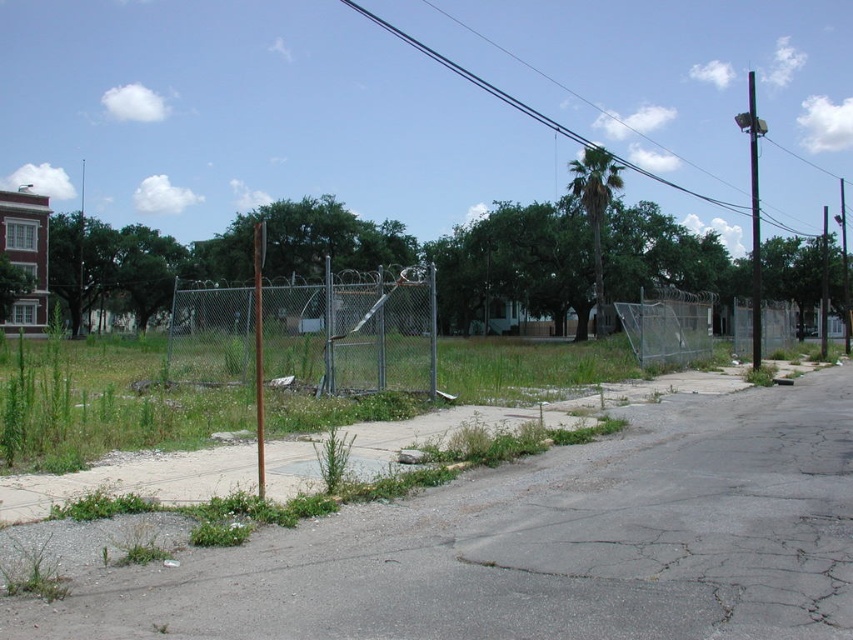
Question: Is green chain-link fence at center further to the viewer compared to green grass at lower left?

Choices:
 (A) yes
 (B) no

Answer: (A)

Question: Where is green grass at lower left located in relation to green leafy weed at lower center in the image?

Choices:
 (A) left
 (B) right

Answer: (A)

Question: Which point appears closest to the camera in this image?

Choices:
 (A) (326, 266)
 (B) (4, 572)

Answer: (B)

Question: Which is nearer to the green leafy weed at lower center?

Choices:
 (A) green chain-link fence at center
 (B) green grass at lower left

Answer: (B)

Question: Among these points, which one is nearest to the camera?

Choices:
 (A) (328, 476)
 (B) (413, 326)
 (C) (42, 596)

Answer: (C)

Question: Where is green chain-link fence at center located in relation to green grass at lower left in the image?

Choices:
 (A) above
 (B) below

Answer: (A)